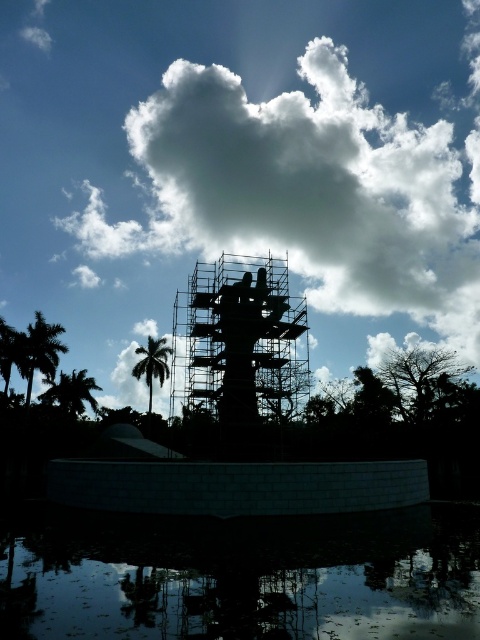
Who is more forward, (x=27, y=374) or (x=145, y=346)?

Point (x=27, y=374) is in front.

Which is more to the left, green leafy palm tree at left or green leafy palm tree at center?

green leafy palm tree at left

Between point (47, 364) and point (160, 340), which one is positioned behind?

Positioned behind is point (160, 340).

Locate an element on the screen. The width and height of the screenshot is (480, 640). green leafy palm tree at left is located at coordinates (36, 349).

Which of these two, transparent glass water at lower center or green leafy palm tree at lower left, stands taller?

Standing taller between the two is green leafy palm tree at lower left.

Is point (385, 573) positioned in front of point (37, 396)?

Yes, point (385, 573) is closer to viewer.

Between point (260, 545) and point (48, 384), which one is positioned in front?

Point (260, 545) is more forward.

The width and height of the screenshot is (480, 640). In order to click on transparent glass water at lower center in this screenshot , I will do `click(240, 577)`.

Is point (23, 364) positioned in front of point (69, 404)?

Yes, point (23, 364) is in front of point (69, 404).

Does green leafy palm tree at left appear on the left side of green leafy palm tree at lower left?

No, green leafy palm tree at left is not to the left of green leafy palm tree at lower left.

In order to click on green leafy palm tree at left in this screenshot , I will do pyautogui.click(x=36, y=349).